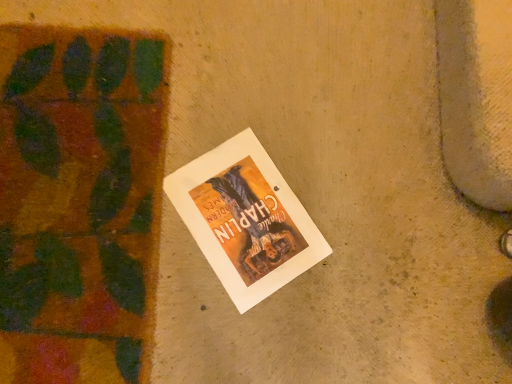
Image resolution: width=512 pixels, height=384 pixels. Find the location of `free space below green leafy plant at left (from a real-world perspective)`. free space below green leafy plant at left (from a real-world perspective) is located at coordinates (70, 186).